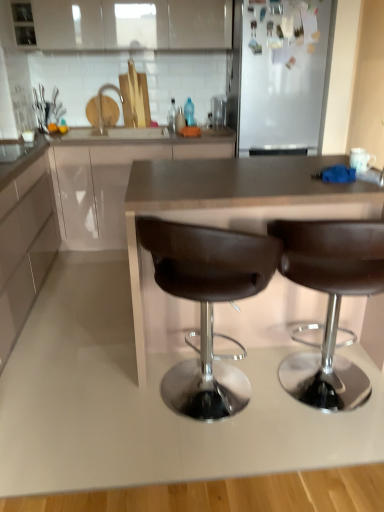
Identify the location of free spot to the left of brown leather stool at center, the 2th chair when ordered from right to left. (95, 398).